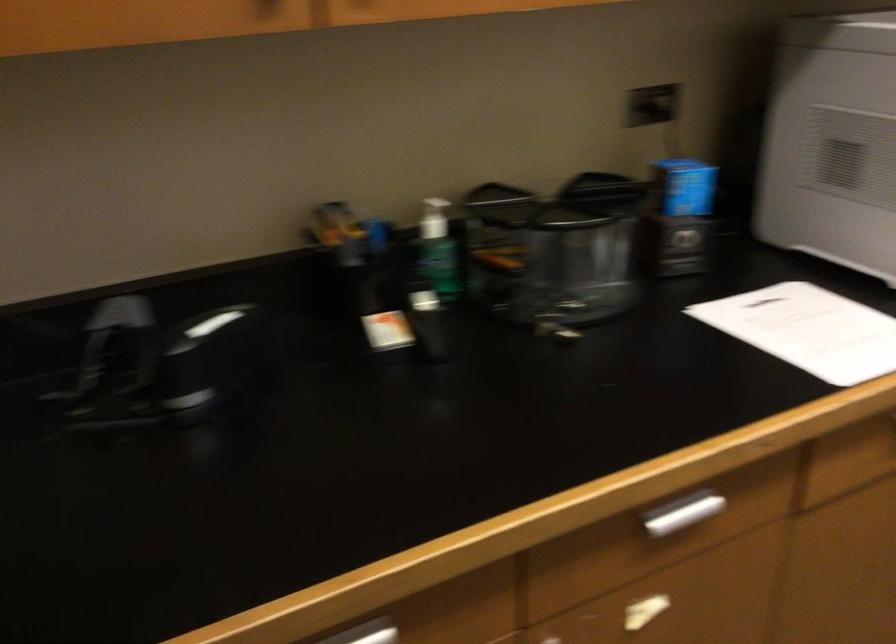
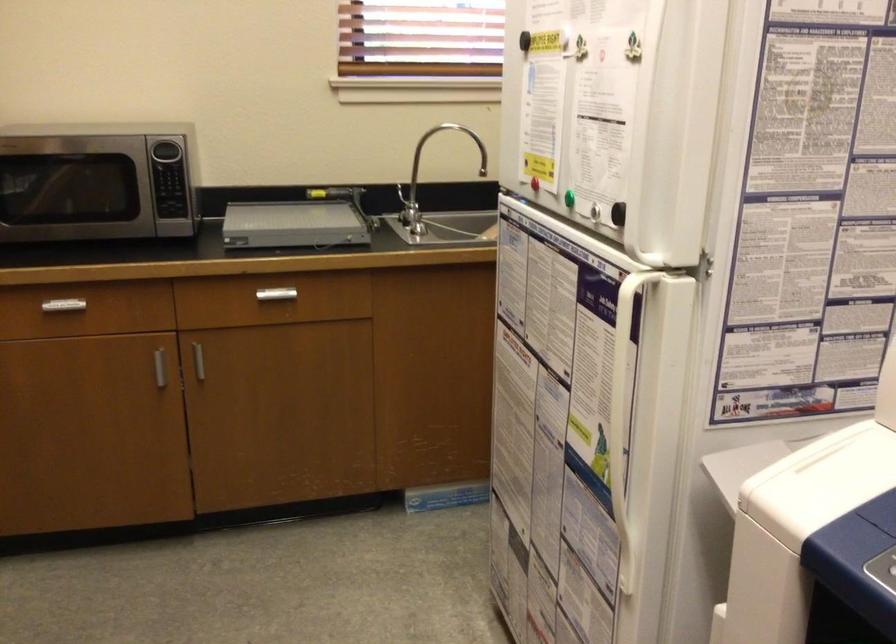
Question: The camera is either moving clockwise (left) or counter-clockwise (right) around the object. The first image is from the beginning of the video and the second image is from the end. Is the camera moving left or right when shooting the video?

Choices:
 (A) Left
 (B) Right

Answer: (A)